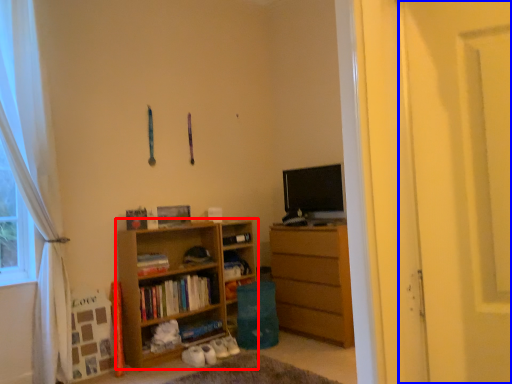
Question: Which object appears farthest to the camera in this image, cupboard (highlighted by a red box) or screen door (highlighted by a blue box)?

Choices:
 (A) cupboard
 (B) screen door

Answer: (A)